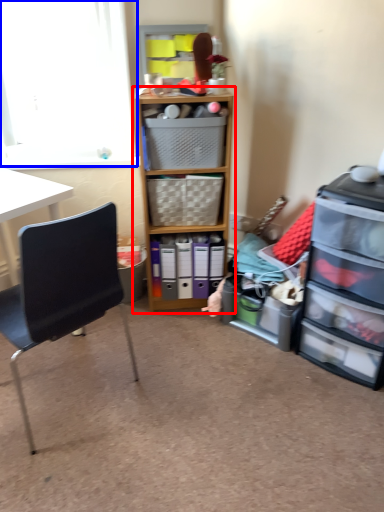
Question: Which object appears closest to the camera in this image, cabinetry (highlighted by a red box) or window screen (highlighted by a blue box)?

Choices:
 (A) cabinetry
 (B) window screen

Answer: (A)